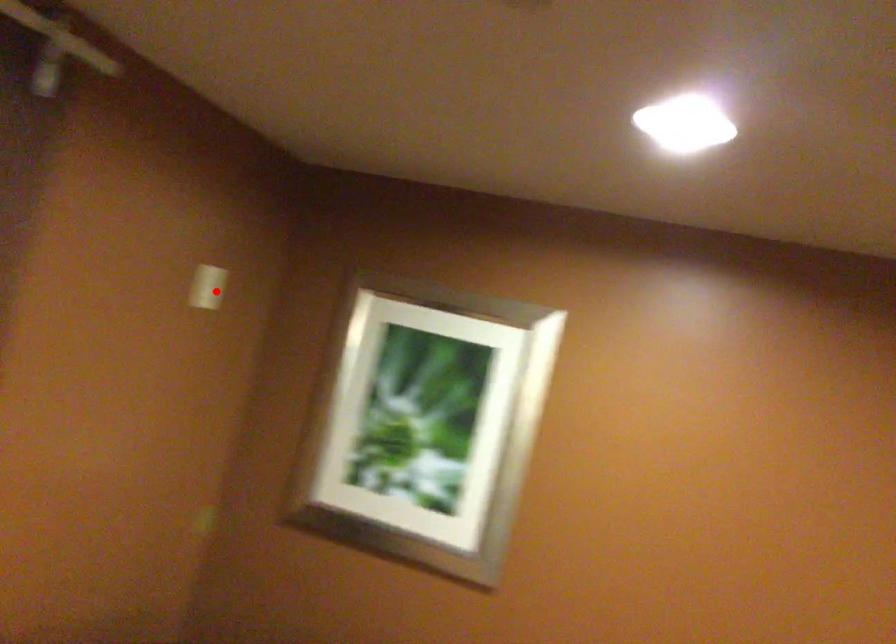
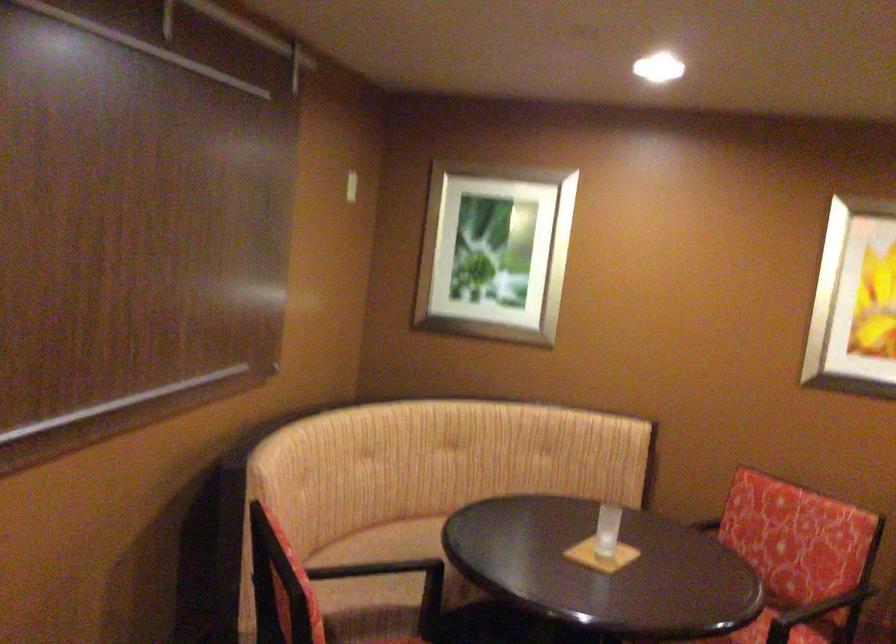
Question: I am providing you with two images of the same scene from different viewpoints. Image1 has a red point marked. In image2, the corresponding 3D location appears at what relative position? Reply with the corresponding letter.

Choices:
 (A) Closer
 (B) Farther

Answer: (B)